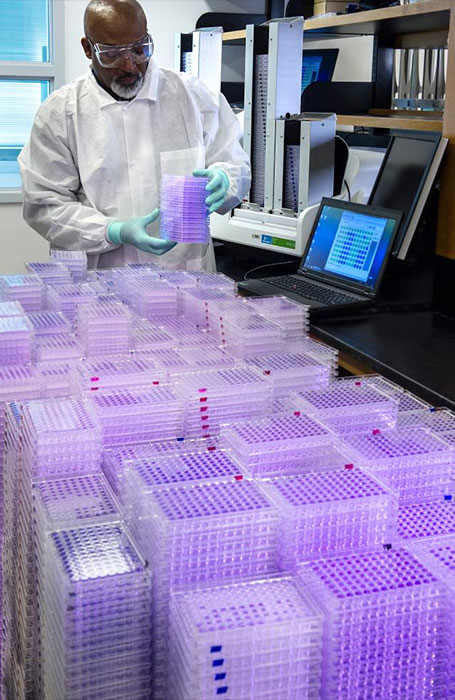
Where is `shelving`? Image resolution: width=455 pixels, height=700 pixels. shelving is located at coordinates (395, 122), (398, 13).